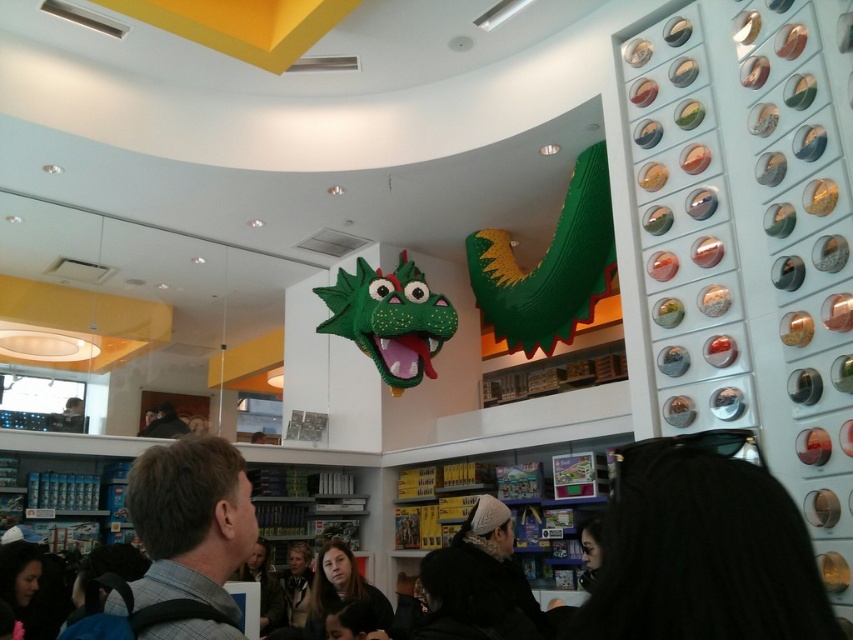
Can you confirm if black hair at lower right is positioned to the right of black fabric at center?

Yes, black hair at lower right is to the right of black fabric at center.

Who is lower down, black hair at lower right or black fabric at center?

black fabric at center is below.

Which is in front, point (747, 579) or point (177, 420)?

Point (747, 579) is more forward.

At what (x,y) coordinates should I click in order to perform the action: click on black hair at lower right. Please return your answer as a coordinate pair (x, y). Looking at the image, I should click on (701, 548).

The width and height of the screenshot is (853, 640). What do you see at coordinates (190, 518) in the screenshot? I see `gray checkered shirt at lower left` at bounding box center [190, 518].

At what (x,y) coordinates should I click in order to perform the action: click on gray checkered shirt at lower left. Please return your answer as a coordinate pair (x, y). Looking at the image, I should click on (190, 518).

Is point (636, 477) positioned in front of point (357, 273)?

That is True.

At what (x,y) coordinates should I click in order to perform the action: click on black hair at lower right. Please return your answer as a coordinate pair (x, y). Looking at the image, I should click on point(701,548).

Between point (804, 614) and point (413, 324), which one is positioned in front?

Point (804, 614)

Image resolution: width=853 pixels, height=640 pixels. In order to click on black hair at lower right in this screenshot , I will do pos(701,548).